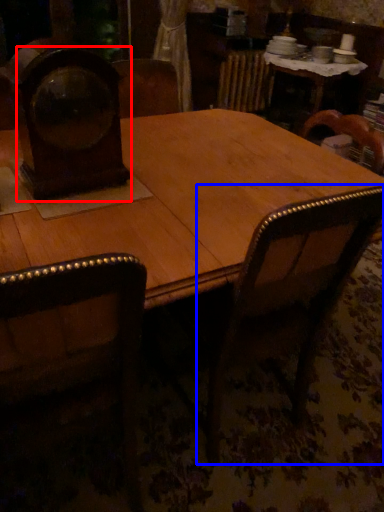
Question: Which object is further to the camera taking this photo, clock (highlighted by a red box) or armchair (highlighted by a blue box)?

Choices:
 (A) clock
 (B) armchair

Answer: (A)